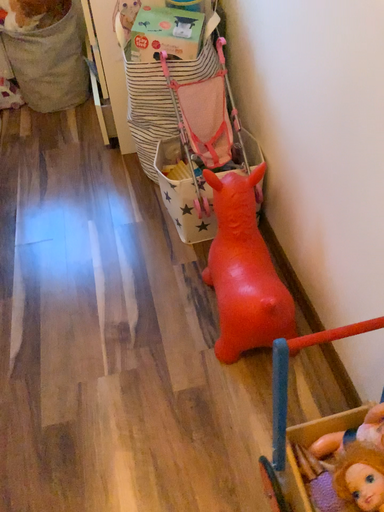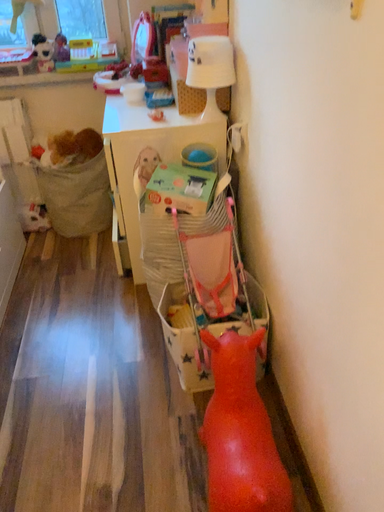
Question: How did the camera likely rotate when shooting the video?

Choices:
 (A) rotated downward
 (B) rotated upward

Answer: (B)